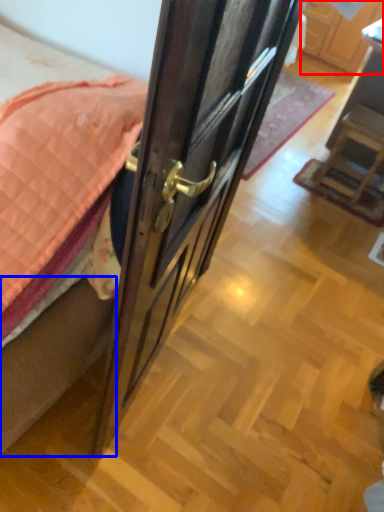
Question: Which of the following is the farthest to the observer, cabinetry (highlighted by a red box) or bed frame (highlighted by a blue box)?

Choices:
 (A) cabinetry
 (B) bed frame

Answer: (A)